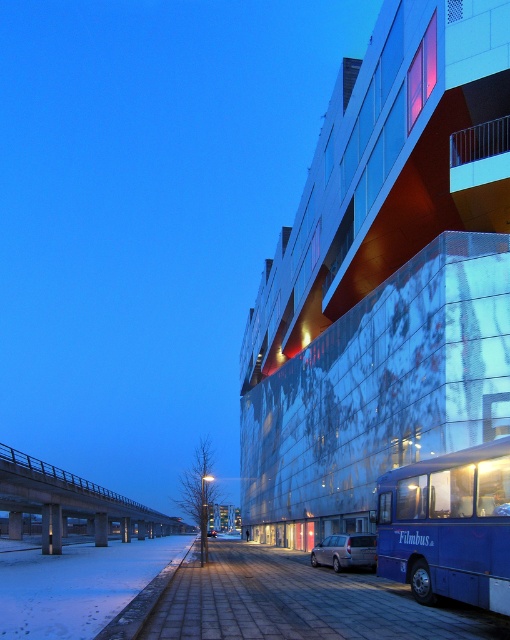
Question: Which object appears farthest from the camera in this image?

Choices:
 (A) blue metallic bus at lower right
 (B) concrete bridge at lower left
 (C) silver metallic van at center

Answer: (B)

Question: Does concrete bridge at lower left have a larger size compared to silver metallic van at center?

Choices:
 (A) no
 (B) yes

Answer: (B)

Question: Can you confirm if silver metallic van at center is positioned below silver metallic car at center?

Choices:
 (A) yes
 (B) no

Answer: (B)

Question: Is blue metallic bus at lower right thinner than silver metallic car at center?

Choices:
 (A) no
 (B) yes

Answer: (B)

Question: Which point is closer to the camera?

Choices:
 (A) silver metallic van at center
 (B) silver metallic car at center
 (C) blue metallic bus at lower right
 (D) concrete bridge at lower left

Answer: (C)

Question: Among these points, which one is farthest from the camera?

Choices:
 (A) (158, 529)
 (B) (215, 532)
 (C) (470, 577)
 (D) (346, 556)

Answer: (A)